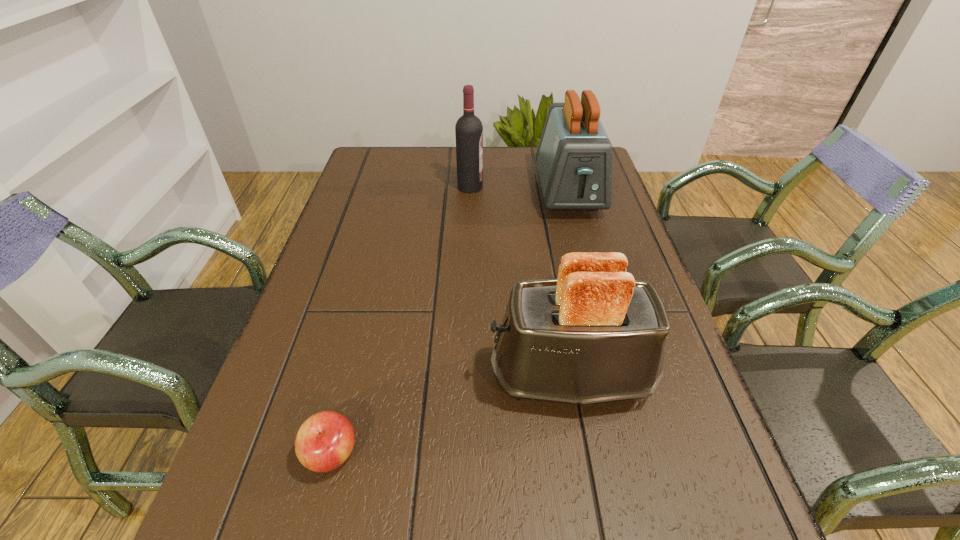
Identify the location of free space located on the left of the apple. (257, 454).

Where is `wine bottle situated at the far edge`? wine bottle situated at the far edge is located at coordinates (468, 130).

Image resolution: width=960 pixels, height=540 pixels. I want to click on toaster that is at the far edge, so click(x=574, y=157).

Locate an element on the screen. The image size is (960, 540). object situated at the left edge is located at coordinates (325, 440).

Image resolution: width=960 pixels, height=540 pixels. I want to click on object located in the far right corner section of the desktop, so click(574, 157).

You are a GUI agent. You are given a task and a screenshot of the screen. Output one action in this format:
    pyautogui.click(x=<x>, y=<y>)
    Task: Click on the vacant space at the far edge
    This screenshot has width=960, height=540.
    Given the screenshot: What is the action you would take?
    pyautogui.click(x=440, y=176)

Locate an element on the screen. free spot at the left edge of the desktop is located at coordinates (321, 357).

Find the location of a particular element. vacant space at the far left corner of the desktop is located at coordinates (391, 150).

The width and height of the screenshot is (960, 540). What are the coordinates of `free space that is in between the apple and the farther toaster` in the screenshot? It's located at (450, 323).

Locate an element on the screen. The width and height of the screenshot is (960, 540). vacant area that lies between the nearest object and the nearer toaster is located at coordinates (451, 415).